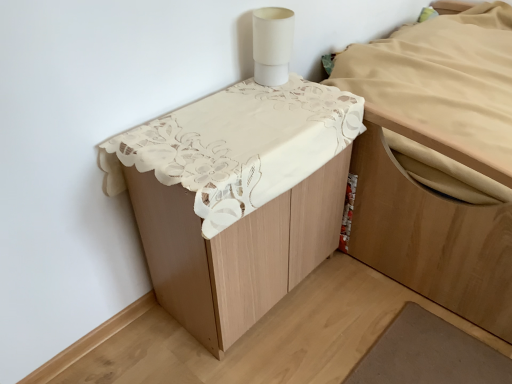
In order to click on free space in front of white matte cylindrical lamp at upper right in this screenshot , I will do `click(275, 101)`.